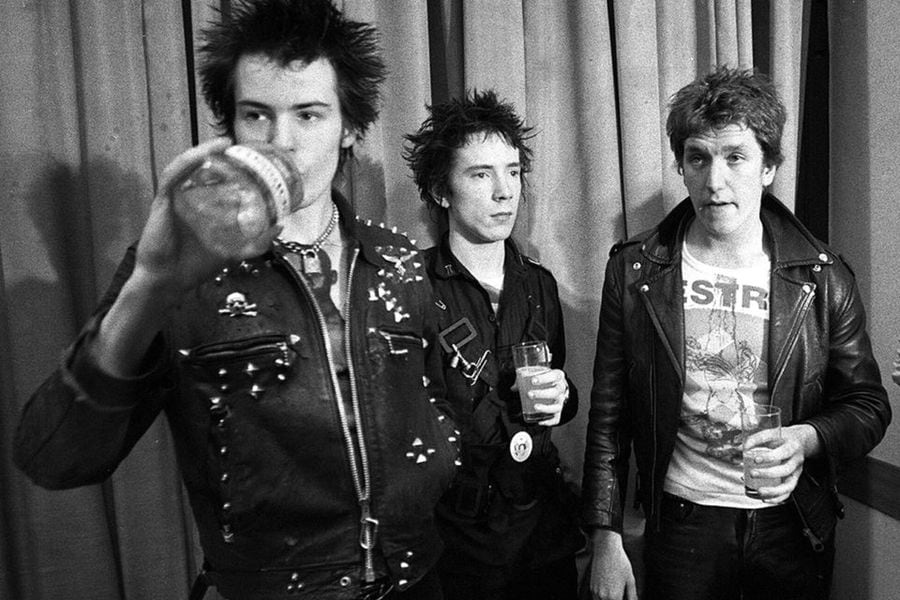
Identify the location of curtain. The width and height of the screenshot is (900, 600). (50, 73), (637, 13).